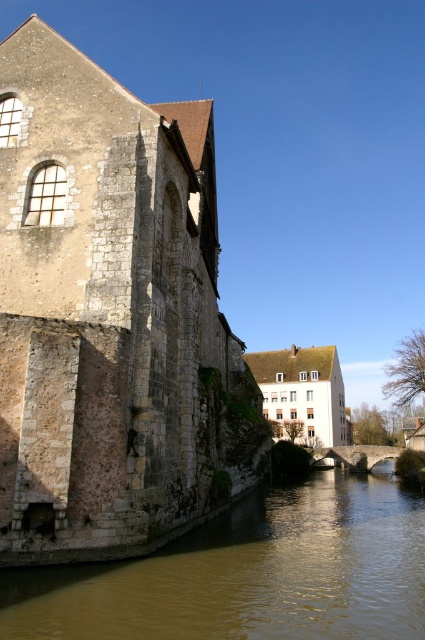
Question: Does stone wall at left have a smaller size compared to brown stone river at lower left?

Choices:
 (A) no
 (B) yes

Answer: (A)

Question: Which point is farther to the camera?

Choices:
 (A) stone wall at left
 (B) brown stone river at lower left

Answer: (A)

Question: Can you confirm if stone wall at left is positioned to the right of brown stone river at lower left?

Choices:
 (A) yes
 (B) no

Answer: (B)

Question: Does stone wall at left appear on the right side of brown stone river at lower left?

Choices:
 (A) no
 (B) yes

Answer: (A)

Question: Which of the following is the farthest from the observer?

Choices:
 (A) (299, 634)
 (B) (61, 134)

Answer: (B)

Question: Which point appears farthest from the camera in this image?

Choices:
 (A) (189, 280)
 (B) (362, 484)

Answer: (B)